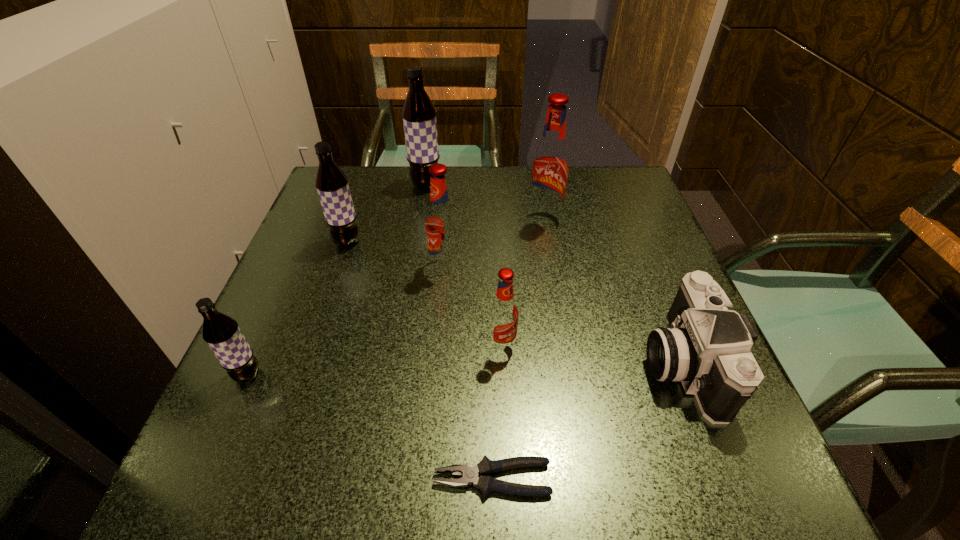
In order to click on vacant position at the right edge of the desktop in this screenshot , I will do `click(629, 278)`.

Where is `free region at the far left corner of the desktop`? This screenshot has height=540, width=960. free region at the far left corner of the desktop is located at coordinates (351, 192).

Locate an element on the screen. Image resolution: width=960 pixels, height=540 pixels. free space between the nearest object and the biggest brown root beer is located at coordinates (459, 332).

In order to click on blank region between the gray pliers and the rightmost object in this screenshot , I will do `click(587, 420)`.

This screenshot has width=960, height=540. I want to click on vacant point located between the nearest object and the rightmost object, so click(x=587, y=420).

What are the coordinates of `free space between the rightmost brown root beer and the smallest brown root beer` in the screenshot? It's located at (337, 280).

You are a GUI agent. You are given a task and a screenshot of the screen. Output one action in this format:
    pyautogui.click(x=<x>, y=<y>)
    Task: Click on the unoccupied position between the smallest red root beer and the rightmost brown root beer
    The width and height of the screenshot is (960, 540).
    Given the screenshot: What is the action you would take?
    pyautogui.click(x=464, y=265)

This screenshot has width=960, height=540. I want to click on free spot between the fifth root beer from left to right and the rightmost object, so click(591, 354).

Find the location of a particular element. Image resolution: width=960 pixels, height=540 pixels. free area in between the nearest root beer and the farthest object is located at coordinates (337, 280).

This screenshot has width=960, height=540. In order to click on vacant space that is in between the leftmost root beer and the second biggest brown root beer in this screenshot , I will do `click(298, 308)`.